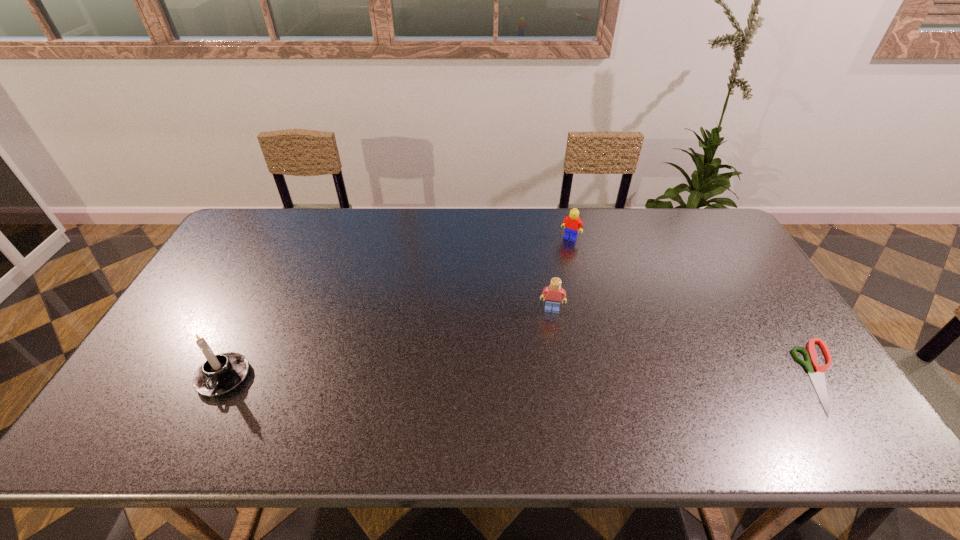
Where is `object present at the near left corner`? The image size is (960, 540). object present at the near left corner is located at coordinates (221, 373).

The image size is (960, 540). What are the coordinates of `object located at the near right corner` in the screenshot? It's located at (818, 379).

Locate an element on the screen. free region at the far edge of the desktop is located at coordinates (597, 214).

Find the location of a particular element. free space at the near edge of the desktop is located at coordinates (283, 383).

The image size is (960, 540). Find the location of `free space at the left edge of the desktop`. free space at the left edge of the desktop is located at coordinates (252, 257).

Identify the location of vacant space at the right edge. (754, 282).

Where is `blank area at the far right corner`? Image resolution: width=960 pixels, height=540 pixels. blank area at the far right corner is located at coordinates (684, 235).

Locate an element on the screen. empty space between the tallest object and the shortest object is located at coordinates (524, 376).

Locate an element on the screen. empty space between the leftmost object and the second farthest object is located at coordinates (388, 343).

Locate an element on the screen. The width and height of the screenshot is (960, 540). vacant area between the rightmost object and the leftmost object is located at coordinates (524, 376).